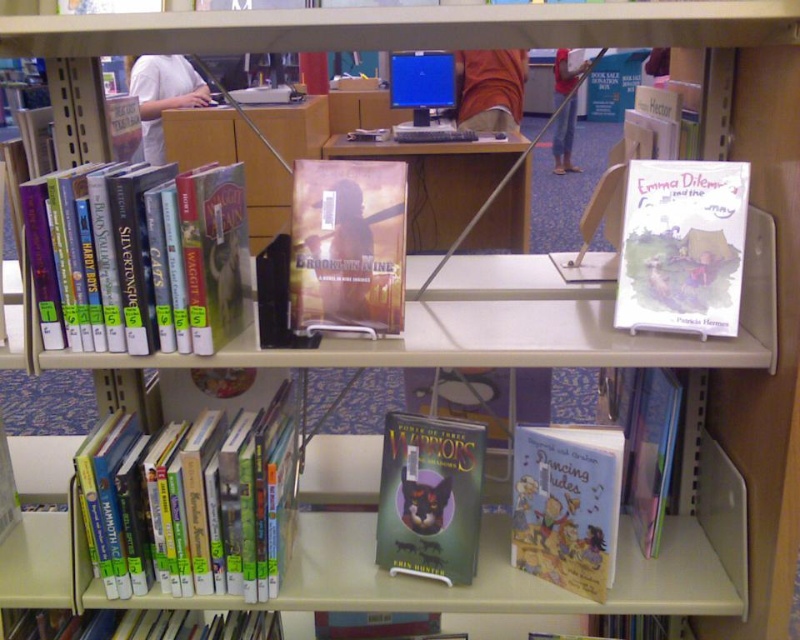
You are a librarian who needs to retrieve the green matte book at center from the shelf. The library requires that you maintain a minimum distance of 1.0 meters from the book to prevent damage. Can you safely retrieve it without violating this rule?

The distance between the green matte book at center and the camera is 1.10 meters, which is greater than the required 1.0 meters. Therefore, you can safely retrieve the green matte book at center without violating the library rule.

You are a librarian trying to place a new book on the top shelf of the library shelving unit. You have two points marked on the shelf where you can place it. The first point is at coordinates point (337, 243) and the second is at point (214, 630). If you want to place the book closer to the front of the shelf, which point should you choose?

You should choose point (337, 243) because it is in front of point (214, 630), so placing the book there would position it closer to the front of the shelf.

In the scene shown: You are a librarian trying to place a new book on the shelf. You have two points marked on the shelf where you can place it. The first point is at coordinates point (356, 323) and the second point is at coordinates point (540, 452). Which point is closer to you, the librarian, so you can reach it easily?

Point (356, 323) is in front of point (540, 452), so it is closer to you and easier to reach.